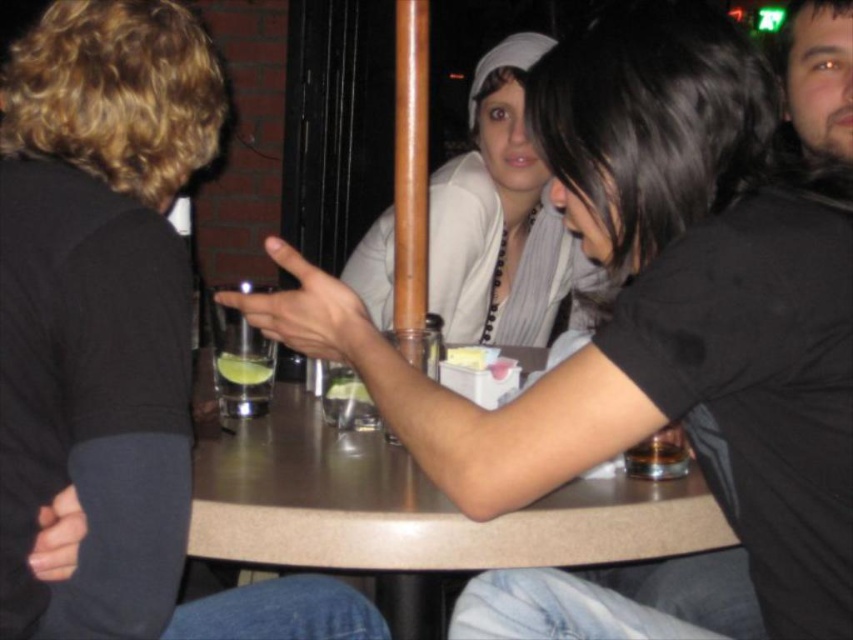
You are a photographer standing behind the matte white shirt at center. You want to take a photo of the green translucent liquid at table center without the shirt blocking it. Can you adjust your position to do so?

The matte white shirt at center is in front of the green translucent liquid at table center, so moving to the side or behind the shirt would allow you to capture the liquid without obstruction.

You are a photographer trying to capture a portrait of the matte white shirt at center without the brown laminate table at center appearing in the shot. Given their relative heights, is this possible?

The matte white shirt at center is taller than the brown laminate table at center, so it is possible to frame the portrait so the table does not appear in the shot.

You are standing at the edge of the table in the dining scene. You want to reach both the point at coordinate (335, 563) and the point at coordinate (488, 83). Which point should you reach first to minimize the distance traveled?

You should reach the point at coordinate (335, 563) first because it is closer to the camera, meaning it is physically nearer to your current position at the edge of the table.